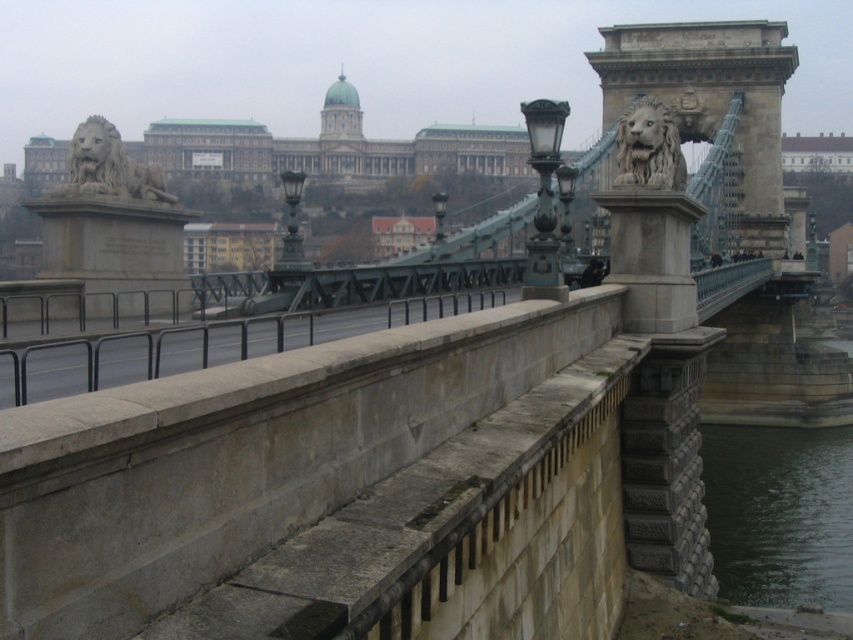
Does dark green water at lower right appear over stone carved lion at upper center?

No, dark green water at lower right is not above stone carved lion at upper center.

Who is positioned more to the left, dark green water at lower right or stone carved lion at upper center?

From the viewer's perspective, stone carved lion at upper center appears more on the left side.

I want to click on dark green water at lower right, so click(x=780, y=513).

Does gray metal rail at center appear under gray stone lion at left?

Indeed, gray metal rail at center is positioned under gray stone lion at left.

Measure the distance between gray metal rail at center and camera.

The distance of gray metal rail at center from camera is 39.78 feet.

I want to click on gray metal rail at center, so 204,346.

At what (x,y) coordinates should I click in order to perform the action: click on gray metal rail at center. Please return your answer as a coordinate pair (x, y). This screenshot has width=853, height=640. Looking at the image, I should click on (204, 346).

Can you confirm if dark green water at lower right is positioned above gray stone lion at left?

Incorrect, dark green water at lower right is not positioned above gray stone lion at left.

Is dark green water at lower right to the left of gray stone lion at left from the viewer's perspective?

No, dark green water at lower right is not to the left of gray stone lion at left.

Does point (793, 532) lie behind point (68, 186)?

Yes, point (793, 532) is farther from viewer.

At what (x,y) coordinates should I click in order to perform the action: click on dark green water at lower right. Please return your answer as a coordinate pair (x, y). This screenshot has height=640, width=853. Looking at the image, I should click on (780, 513).